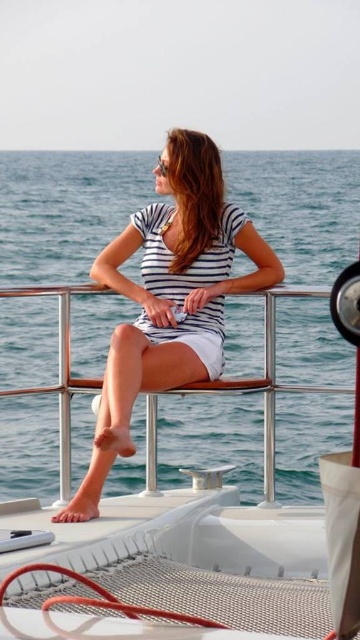
Question: Which of the following is the farthest from the observer?

Choices:
 (A) (153, 225)
 (B) (87, 634)

Answer: (A)

Question: Does white matte boat at center have a smaller size compared to white striped dress at center?

Choices:
 (A) no
 (B) yes

Answer: (A)

Question: In this image, where is white matte boat at center located relative to white striped dress at center?

Choices:
 (A) right
 (B) left

Answer: (A)

Question: Which point is closer to the camera?

Choices:
 (A) white matte boat at center
 (B) white striped dress at center

Answer: (A)

Question: From the image, what is the correct spatial relationship of white matte boat at center in relation to white striped dress at center?

Choices:
 (A) above
 (B) below

Answer: (B)